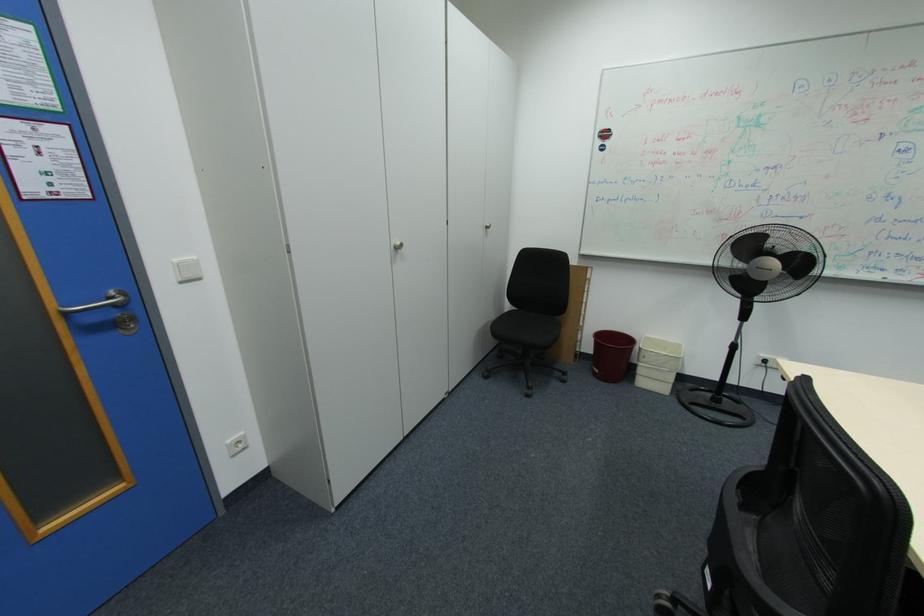
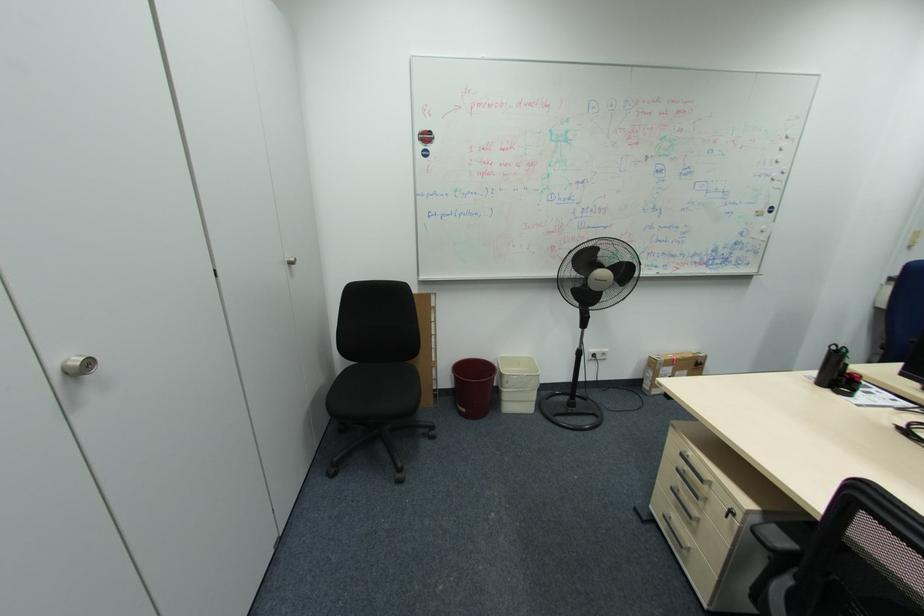
Question: The camera is either moving clockwise (left) or counter-clockwise (right) around the object. The first image is from the beginning of the video and the second image is from the end. Is the camera moving left or right when shooting the video?

Choices:
 (A) Left
 (B) Right

Answer: (A)